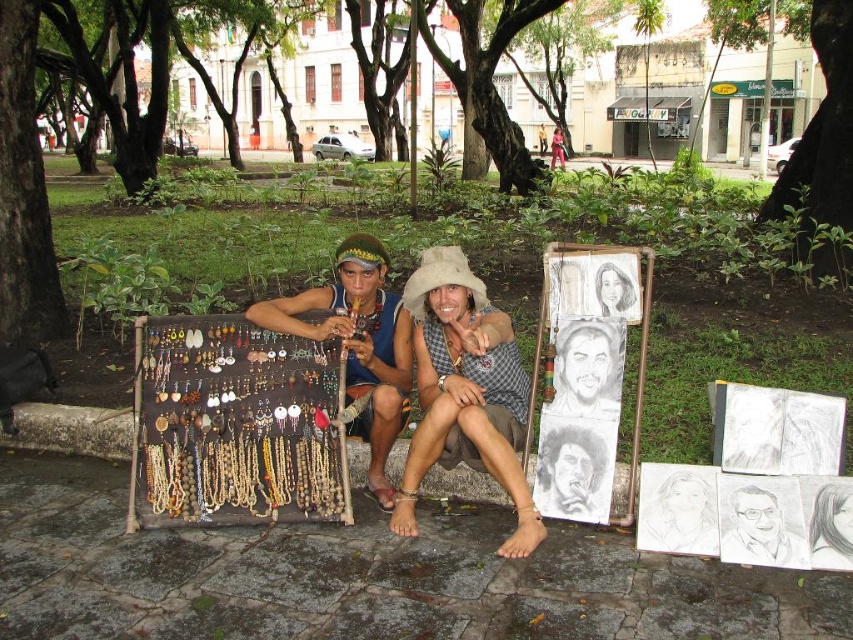
Question: Can you confirm if wooden beads at center is positioned above wooden beads at left?

Choices:
 (A) yes
 (B) no

Answer: (B)

Question: Which object appears farthest from the camera in this image?

Choices:
 (A) wooden beads at center
 (B) wooden beads at left

Answer: (B)

Question: Which point is closer to the camera?

Choices:
 (A) (488, 372)
 (B) (364, 328)

Answer: (A)

Question: Can you confirm if wooden beads at center is positioned to the right of wooden beads at left?

Choices:
 (A) no
 (B) yes

Answer: (B)

Question: Among these points, which one is nearest to the camera?

Choices:
 (A) pos(370,243)
 (B) pos(252,307)

Answer: (B)

Question: Considering the relative positions of wooden beads at center and wooden beads at left in the image provided, where is wooden beads at center located with respect to wooden beads at left?

Choices:
 (A) below
 (B) above

Answer: (A)